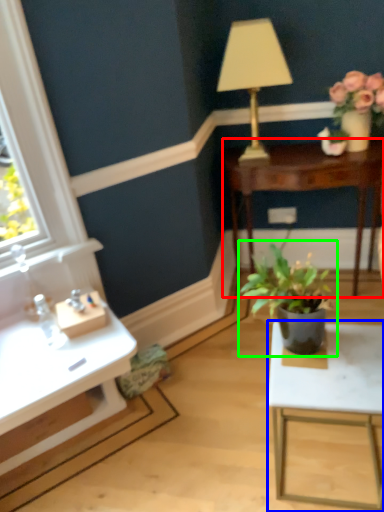
Question: Estimate the real-world distances between objects in this image. Which object is closer to table (highlighted by a red box), table (highlighted by a blue box) or houseplant (highlighted by a green box)?

Choices:
 (A) table
 (B) houseplant

Answer: (B)